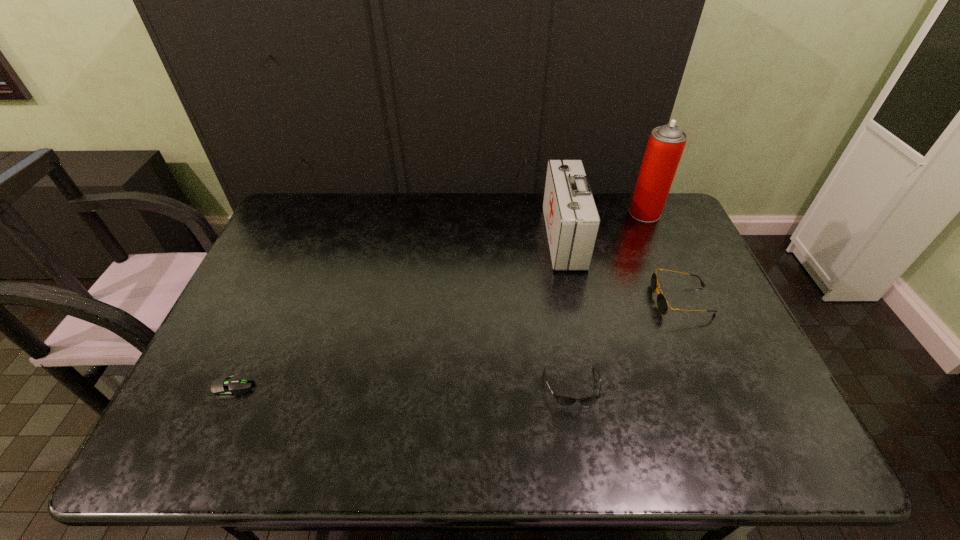
Find the location of a particular element. The width and height of the screenshot is (960, 540). blank space located on the front-facing side of the first-aid kit is located at coordinates (502, 238).

Locate an element on the screen. This screenshot has height=540, width=960. vacant region located on the front-facing side of the first-aid kit is located at coordinates (484, 238).

Locate an element on the screen. blank space located on the front-facing side of the farther sunglasses is located at coordinates (625, 300).

Where is `blank area located 0.110m on the front-facing side of the farther sunglasses`? blank area located 0.110m on the front-facing side of the farther sunglasses is located at coordinates (614, 300).

Image resolution: width=960 pixels, height=540 pixels. What are the coordinates of `free region located 0.240m on the front-facing side of the farther sunglasses` in the screenshot? It's located at (569, 300).

Locate an element on the screen. Image resolution: width=960 pixels, height=540 pixels. free space located 0.050m on the front-facing side of the fourth tallest object is located at coordinates (579, 430).

Locate an element on the screen. Image resolution: width=960 pixels, height=540 pixels. free location located on the front of the leftmost object is located at coordinates (204, 454).

The width and height of the screenshot is (960, 540). I want to click on aerosol can at the far edge, so click(666, 144).

At what (x,y) coordinates should I click in order to perform the action: click on the first-aid kit that is at the far edge. Please return your answer as a coordinate pair (x, y). The height and width of the screenshot is (540, 960). Looking at the image, I should click on (572, 221).

Find the location of a particular element. The image size is (960, 540). object that is at the left edge is located at coordinates 224,387.